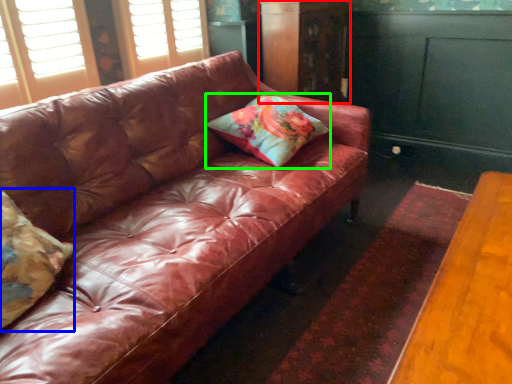
Question: Which object is the closest to the dresser (highlighted by a red box)? Choose among these: pillow (highlighted by a blue box) or pillow (highlighted by a green box).

Choices:
 (A) pillow
 (B) pillow

Answer: (B)